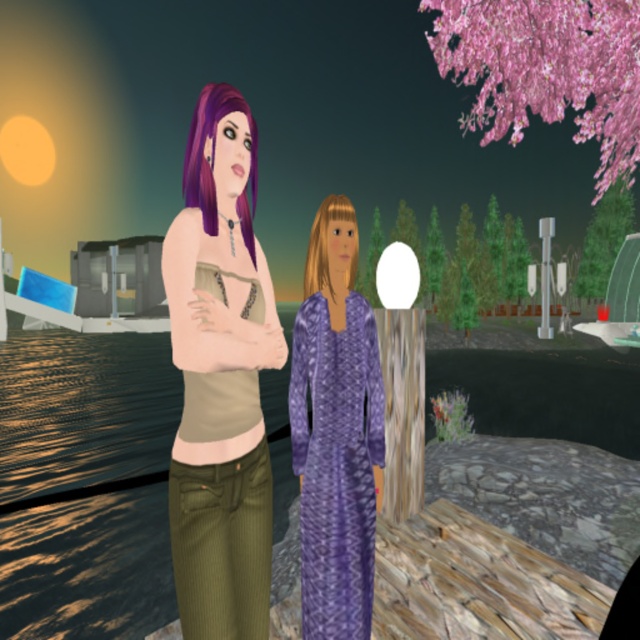
Does pink blossom tree at upper right have a greater width compared to wooden post at center?

Indeed, pink blossom tree at upper right has a greater width compared to wooden post at center.

Looking at this image, which of these two, pink blossom tree at upper right or wooden post at center, stands shorter?

wooden post at center

Between point (593, 253) and point (371, 300), which one is positioned in front?

Positioned in front is point (593, 253).

Find the location of a particular element. This screenshot has height=640, width=640. pink blossom tree at upper right is located at coordinates (604, 241).

Which is above, matte green corduroy pants at left or blondehair at center?

Positioned higher is blondehair at center.

Who is more distant from viewer, (204, 465) or (349, 280)?

The point (349, 280) is more distant.

Which is behind, point (262, 636) or point (323, 209)?

The point (323, 209) is more distant.

Find the location of a particular element. matte green corduroy pants at left is located at coordinates (220, 378).

Describe the element at coordinates (604, 241) in the screenshot. The image size is (640, 640). I see `pink blossom tree at upper right` at that location.

Is pink blossom tree at upper right thinner than green textured tree at center?

In fact, pink blossom tree at upper right might be wider than green textured tree at center.

Find the location of a particular element. pink blossom tree at upper right is located at coordinates (604, 241).